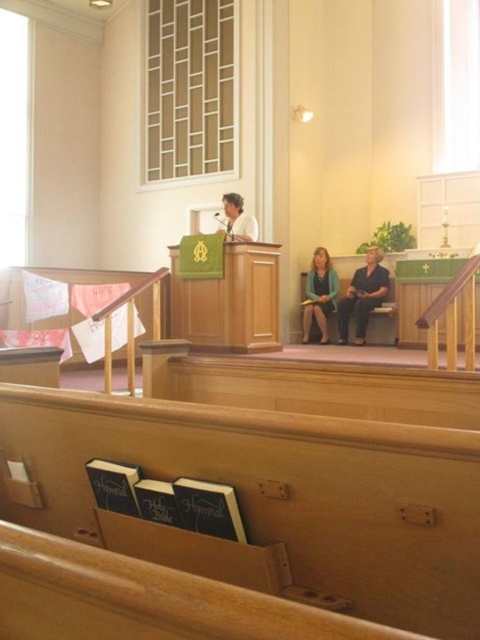
Is point (350, 300) closer to viewer compared to point (313, 273)?

That is True.

This screenshot has height=640, width=480. Find the location of `black fabric at center`. black fabric at center is located at coordinates (362, 296).

Where is `black fabric at center`? The image size is (480, 640). black fabric at center is located at coordinates 362,296.

Image resolution: width=480 pixels, height=640 pixels. Find the location of `black fabric at center`. black fabric at center is located at coordinates (362, 296).

Is black fabric at center wider than light brown wooden podium at center?

Yes, black fabric at center is wider than light brown wooden podium at center.

The width and height of the screenshot is (480, 640). What do you see at coordinates (362, 296) in the screenshot? I see `black fabric at center` at bounding box center [362, 296].

At what (x,y) coordinates should I click in order to perform the action: click on black fabric at center. Please return your answer as a coordinate pair (x, y). The image size is (480, 640). Looking at the image, I should click on (362, 296).

Which of these two, green fabric jacket at center or light brown wooden podium at center, stands shorter?

light brown wooden podium at center

What do you see at coordinates (319, 296) in the screenshot?
I see `green fabric jacket at center` at bounding box center [319, 296].

Does point (333, 275) lie behind point (242, 225)?

Yes.

Locate an element on the screen. green fabric jacket at center is located at coordinates (319, 296).